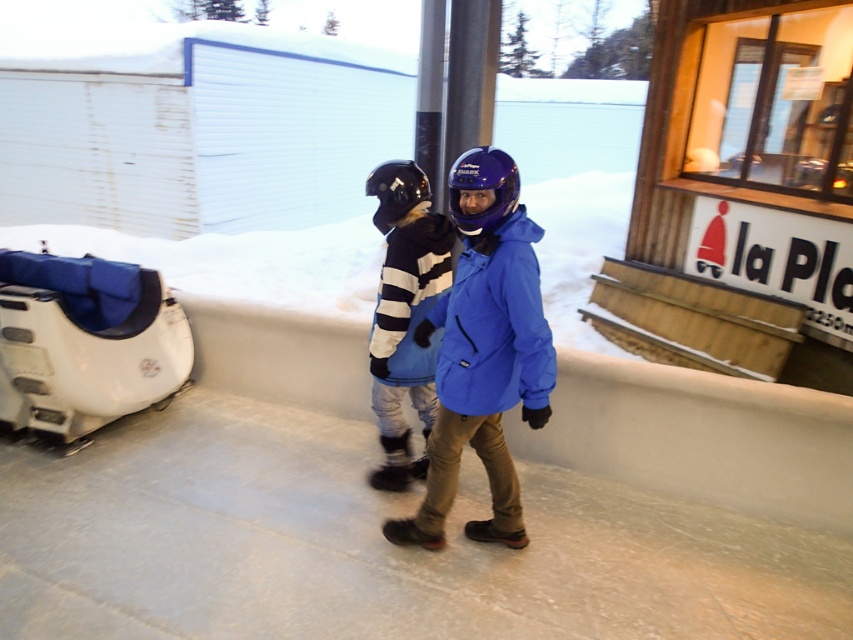
Is blue fabric snowmobile at lower left smaller than striped fleece jacket at center?

No, blue fabric snowmobile at lower left is not smaller than striped fleece jacket at center.

Between point (19, 308) and point (396, 332), which one is positioned in front?

Positioned in front is point (396, 332).

Find the location of a particular element. The image size is (853, 640). blue fabric snowmobile at lower left is located at coordinates (86, 340).

Is blue matte jacket at center bigger than striped fleece jacket at center?

Yes.

Looking at this image, which of these two, blue matte jacket at center or striped fleece jacket at center, stands taller?

With more height is blue matte jacket at center.

Where is `blue matte jacket at center`? This screenshot has height=640, width=853. blue matte jacket at center is located at coordinates (485, 352).

Between point (457, 385) and point (24, 385), which one is positioned behind?

Positioned behind is point (24, 385).

Does blue matte jacket at center lie behind blue fabric snowmobile at lower left?

No, it is in front of blue fabric snowmobile at lower left.

From the picture: Who is more forward, (444, 401) or (132, 301)?

Point (444, 401) is more forward.

Locate an element on the screen. blue matte jacket at center is located at coordinates [485, 352].